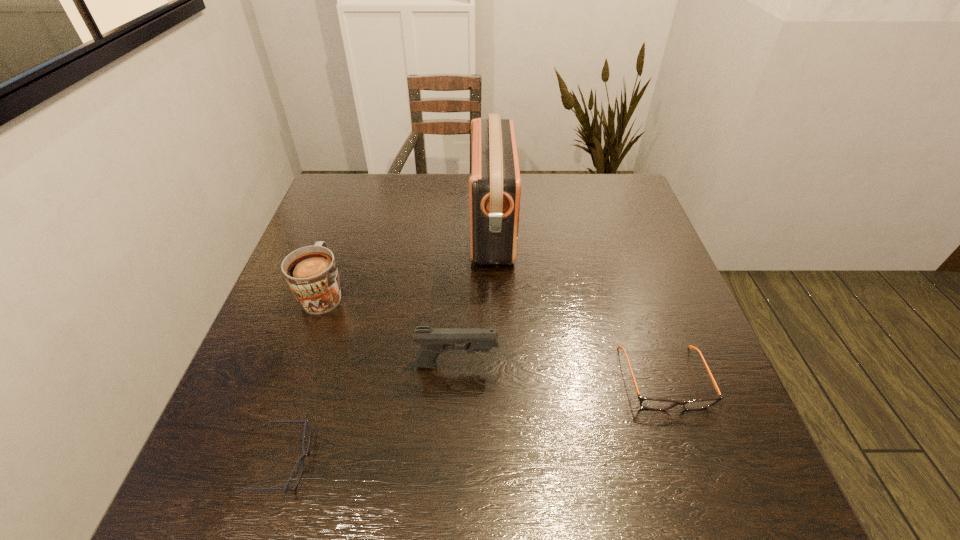
You are a GUI agent. You are given a task and a screenshot of the screen. Output one action in this format:
    pyautogui.click(x=<x>, y=<y>)
    Task: Click on the tallest object
    This screenshot has width=960, height=540.
    Given the screenshot: What is the action you would take?
    pyautogui.click(x=495, y=184)

Find the location of a particular element. This screenshot has height=540, width=960. mug is located at coordinates (311, 273).

Where is `pistol`? Image resolution: width=960 pixels, height=540 pixels. pistol is located at coordinates (433, 342).

The image size is (960, 540). I want to click on the right spectacles, so click(x=649, y=403).

Image resolution: width=960 pixels, height=540 pixels. I want to click on the farther spectacles, so click(649, 403).

Locate an element on the screen. This screenshot has height=540, width=960. the left spectacles is located at coordinates (302, 457).

At what (x,y) coordinates should I click in order to perform the action: click on the nearest object. Please return your answer as a coordinate pair (x, y). Image resolution: width=960 pixels, height=540 pixels. Looking at the image, I should click on (302, 457).

Where is `vacant space located 0.300m on the front-facing side of the tallest object`? vacant space located 0.300m on the front-facing side of the tallest object is located at coordinates (364, 228).

At what (x,y) coordinates should I click in order to perform the action: click on free spot located 0.320m on the front-facing side of the tallest object. Please return your answer as a coordinate pair (x, y). Image resolution: width=960 pixels, height=540 pixels. Looking at the image, I should click on (357, 228).

The height and width of the screenshot is (540, 960). In order to click on free space located on the front-facing side of the tallest object in this screenshot , I will do `click(332, 228)`.